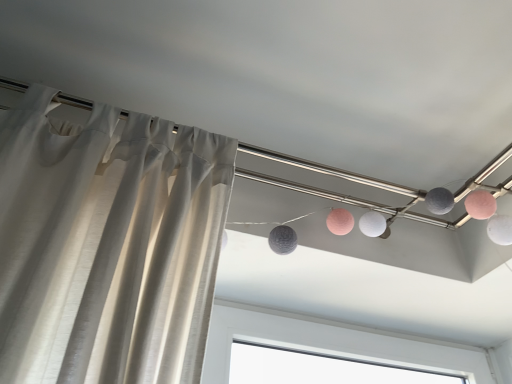
Locate an element on the screen. Image resolution: width=512 pixels, height=384 pixels. white matte window at center is located at coordinates (331, 342).

Measure the distance between point (360, 349) and camera.

The distance of point (360, 349) from camera is 1.29 meters.

What do you see at coordinates (331, 342) in the screenshot? The image size is (512, 384). I see `white matte window at center` at bounding box center [331, 342].

Find the location of a particular element. This screenshot has width=512, height=384. white matte window at center is located at coordinates (331, 342).